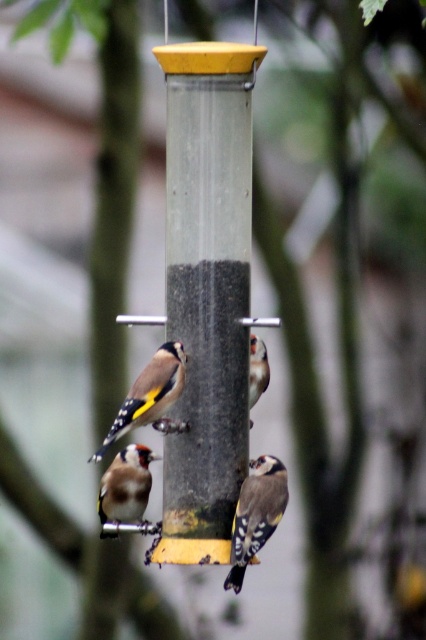
You are a birdwatcher observing the scene. You notice two birds in particular. The first is the yellow and black speckled bird at center, and the second is the brown speckled feathers at lower left. Which of these two birds is taller?

The yellow and black speckled bird at center is much taller than the brown speckled feathers at lower left.